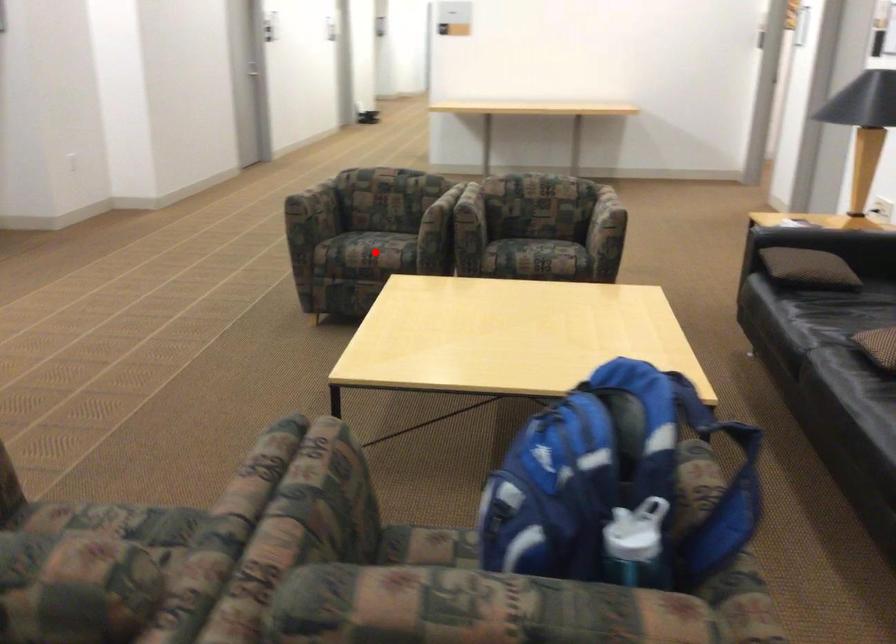
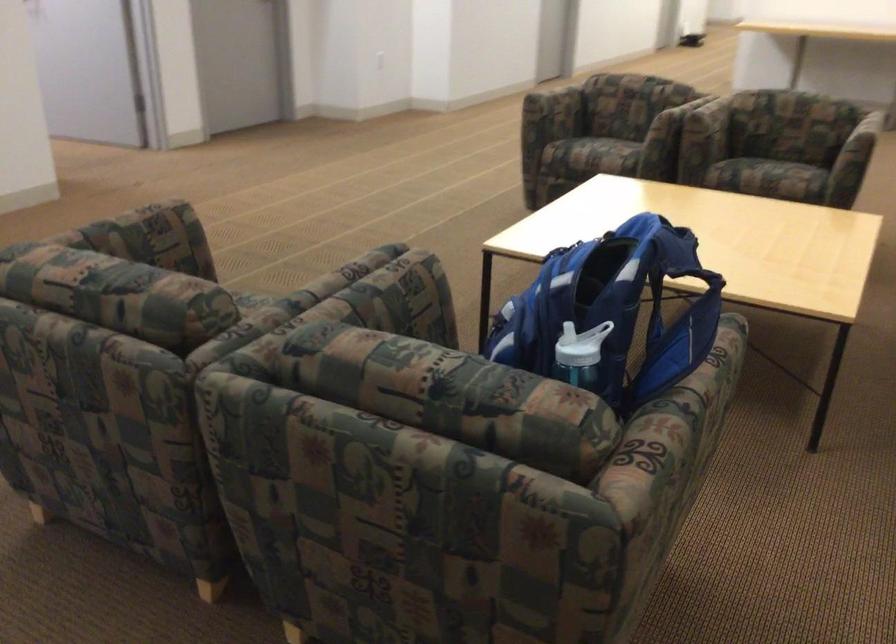
Find the pixel in the second image that matches the highlighted location in the first image.

(597, 152)